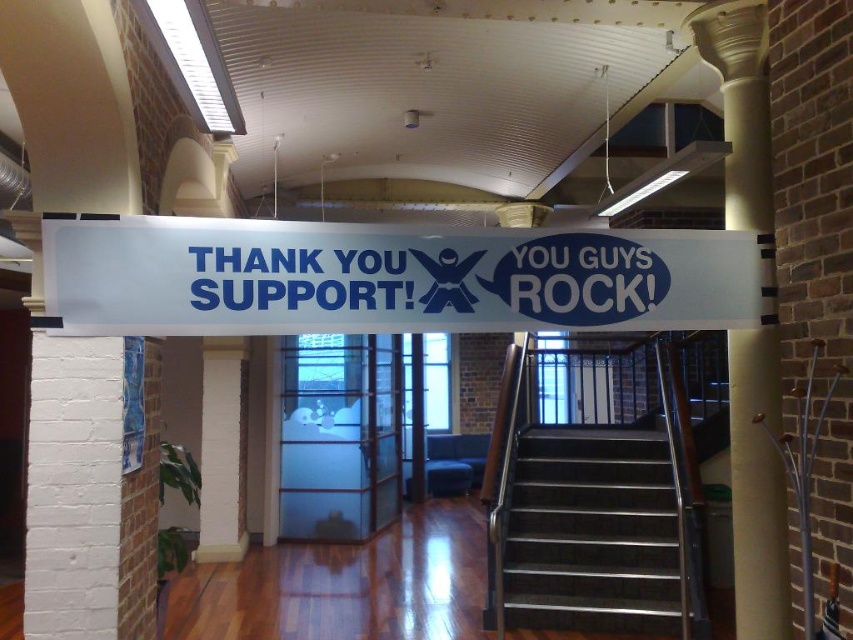
Question: Which object is farther from the camera taking this photo?

Choices:
 (A) transparent glass door at center
 (B) white plastic banner at center
 (C) white painted brick pillar at left
 (D) stainless steel stairs at center

Answer: (A)

Question: Which point is farther to the camera?

Choices:
 (A) white painted brick pillar at left
 (B) white plastic banner at center

Answer: (B)

Question: Based on their relative distances, which object is nearer to the white plastic banner at center?

Choices:
 (A) stainless steel stairs at center
 (B) transparent glass door at center

Answer: (A)

Question: Does white plastic banner at center appear over white smooth column at center?

Choices:
 (A) yes
 (B) no

Answer: (A)

Question: Observing the image, what is the correct spatial positioning of transparent glass door at center in reference to white textured pillar at lower left?

Choices:
 (A) above
 (B) below

Answer: (B)

Question: Can you confirm if white plastic banner at center is wider than white painted brick pillar at left?

Choices:
 (A) yes
 (B) no

Answer: (A)